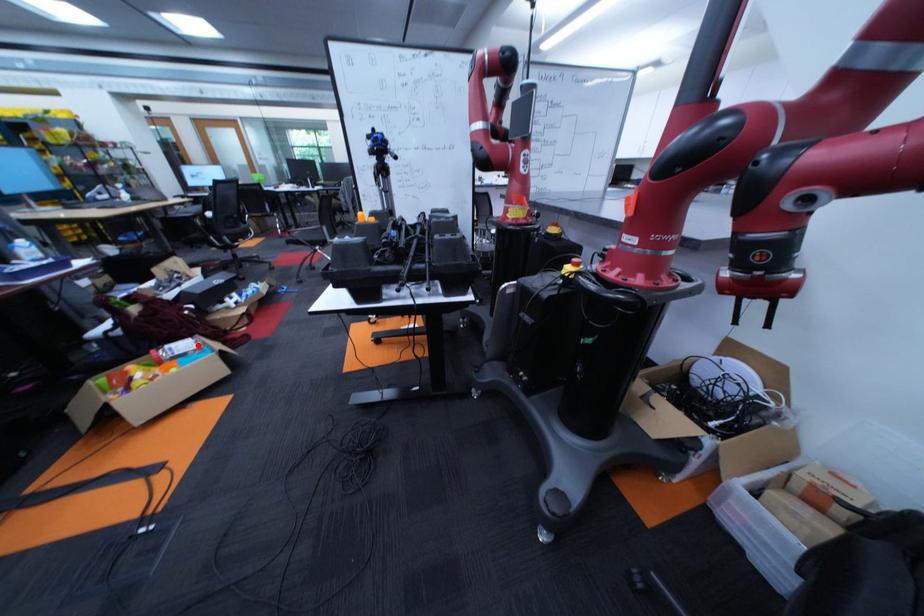
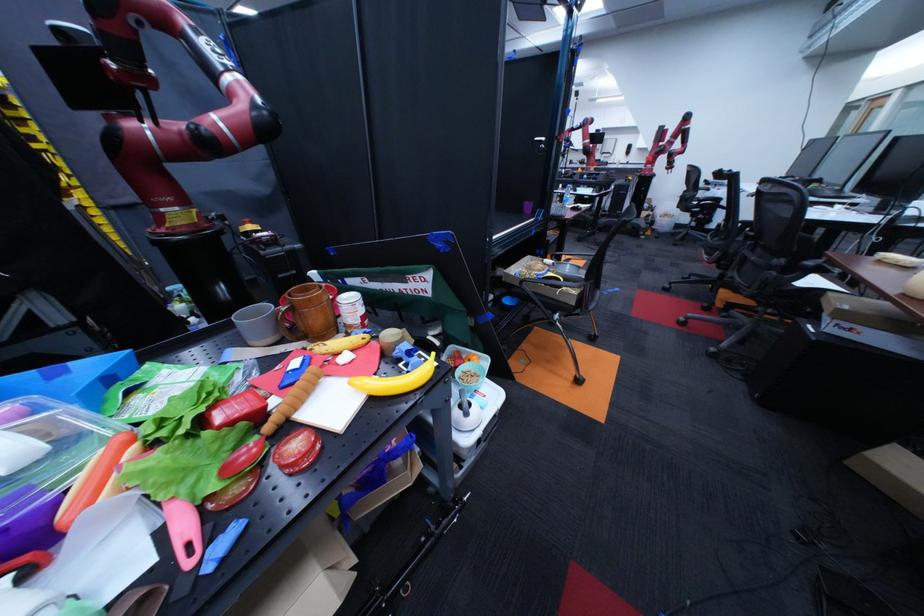
Question: I am providing you with two images of the same scene from different viewpoints. A red point is marked on the first image. Can you still see the location of the red point in image 2?

Choices:
 (A) Yes
 (B) No

Answer: (B)